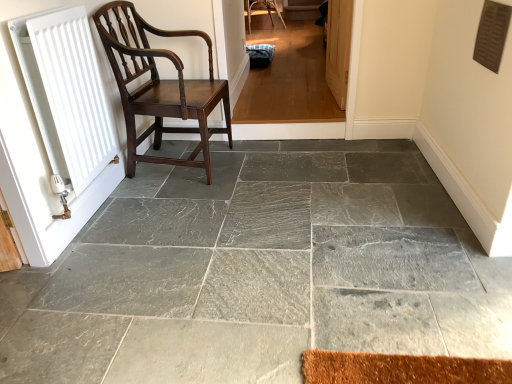
The width and height of the screenshot is (512, 384). What are the coordinates of `wooden screen door at upper right` in the screenshot? It's located at (338, 48).

What do you see at coordinates (159, 86) in the screenshot? I see `dark wood chair at left` at bounding box center [159, 86].

The width and height of the screenshot is (512, 384). Describe the element at coordinates (259, 272) in the screenshot. I see `gray stone floor at center` at that location.

Where is `wooden screen door at upper right`? The width and height of the screenshot is (512, 384). wooden screen door at upper right is located at coordinates (338, 48).

From the image's perspective, would you say white matte radiator at left is positioned over dark wood chair at left?

No, from the image's perspective, white matte radiator at left is not on top of dark wood chair at left.

What's the angular difference between white matte radiator at left and dark wood chair at left's facing directions?

1.58 degrees separate the facing orientations of white matte radiator at left and dark wood chair at left.

From the picture: Can you confirm if white matte radiator at left is positioned to the right of dark wood chair at left?

No, white matte radiator at left is not to the right of dark wood chair at left.

Where is `radiator above the dark wood chair at left (from a real-world perspective)`? Image resolution: width=512 pixels, height=384 pixels. radiator above the dark wood chair at left (from a real-world perspective) is located at coordinates (67, 94).

Considering the relative sizes of wooden screen door at upper right and white matte radiator at left in the image provided, is wooden screen door at upper right taller than white matte radiator at left?

No, wooden screen door at upper right is not taller than white matte radiator at left.

Is white matte radiator at left completely or partially inside wooden screen door at upper right?

No, white matte radiator at left is not inside wooden screen door at upper right.

Which object is thinner, wooden screen door at upper right or white matte radiator at left?

With smaller width is wooden screen door at upper right.

Can you confirm if wooden screen door at upper right is positioned to the left of white matte radiator at left?

No, wooden screen door at upper right is not to the left of white matte radiator at left.

Where is `chair that is on the left side of gray stone floor at center`? Image resolution: width=512 pixels, height=384 pixels. chair that is on the left side of gray stone floor at center is located at coordinates (159, 86).

How many degrees apart are the facing directions of dark wood chair at left and gray stone floor at center?

The facing directions of dark wood chair at left and gray stone floor at center are 86.8 degrees apart.

Does dark wood chair at left lie behind gray stone floor at center?

Yes.

Is point (136, 161) farther from camera compared to point (388, 349)?

Yes.

Considering the positions of objects dark wood chair at left and wooden screen door at upper right in the image provided, who is more to the left, dark wood chair at left or wooden screen door at upper right?

dark wood chair at left.

Between dark wood chair at left and wooden screen door at upper right, which one has smaller width?

wooden screen door at upper right.

Is point (230, 118) closer or farther from the camera than point (348, 15)?

Point (230, 118).

Find the location of a particular element. This screenshot has width=512, height=384. chair that appears below the wooden screen door at upper right (from the image's perspective) is located at coordinates (159, 86).

From the picture: Which object is positioned more to the left, wooden screen door at upper right or dark wood chair at left?

Positioned to the left is dark wood chair at left.

Considering the sizes of objects wooden screen door at upper right and dark wood chair at left in the image provided, who is wider, wooden screen door at upper right or dark wood chair at left?

Wider between the two is dark wood chair at left.

How many degrees apart are the facing directions of wooden screen door at upper right and dark wood chair at left?

wooden screen door at upper right and dark wood chair at left are facing 178 degrees away from each other.

Is gray stone floor at center not inside white matte radiator at left?

That's correct, gray stone floor at center is outside of white matte radiator at left.

From a real-world perspective, does gray stone floor at center stand above white matte radiator at left?

Incorrect, from a real-world perspective, gray stone floor at center is lower than white matte radiator at left.

Looking at this image, considering their positions, is gray stone floor at center located in front of or behind white matte radiator at left?

gray stone floor at center is in front of white matte radiator at left.

Which object is further away from the camera, dark wood chair at left or white matte radiator at left?

dark wood chair at left is more distant.

Does dark wood chair at left turn towards white matte radiator at left?

No, dark wood chair at left is not facing towards white matte radiator at left.

From a real-world perspective, between dark wood chair at left and white matte radiator at left, who is vertically lower?

dark wood chair at left, from a real-world perspective.

Identify the location of radiator on the left of dark wood chair at left. The image size is (512, 384). (67, 94).

Locate an element on the screen. The width and height of the screenshot is (512, 384). radiator that is above the wooden screen door at upper right (from a real-world perspective) is located at coordinates (67, 94).

Estimate the real-world distances between objects in this image. Which object is closer to gray stone floor at center, dark wood chair at left or white matte radiator at left?

dark wood chair at left lies closer to gray stone floor at center than the other object.

Estimate the real-world distances between objects in this image. Which object is further from white matte radiator at left, dark wood chair at left or gray stone floor at center?

gray stone floor at center.

Estimate the real-world distances between objects in this image. Which object is further from gray stone floor at center, white matte radiator at left or dark wood chair at left?

Based on the image, white matte radiator at left appears to be further to gray stone floor at center.

Estimate the real-world distances between objects in this image. Which object is closer to white matte radiator at left, wooden screen door at upper right or gray stone floor at center?

gray stone floor at center is closer to white matte radiator at left.

Estimate the real-world distances between objects in this image. Which object is further from wooden screen door at upper right, white matte radiator at left or gray stone floor at center?

Based on the image, white matte radiator at left appears to be further to wooden screen door at upper right.

From the image, which object appears to be nearer to gray stone floor at center, wooden screen door at upper right or white matte radiator at left?

Among the two, white matte radiator at left is located nearer to gray stone floor at center.

Which object lies nearer to the anchor point white matte radiator at left, gray stone floor at center or wooden screen door at upper right?

gray stone floor at center.

Based on their spatial positions, is dark wood chair at left or white matte radiator at left closer to wooden screen door at upper right?

Based on the image, dark wood chair at left appears to be nearer to wooden screen door at upper right.

Find the location of `radiator between gray stone floor at center and wooden screen door at upper right along the z-axis`. radiator between gray stone floor at center and wooden screen door at upper right along the z-axis is located at coordinates (67, 94).

This screenshot has height=384, width=512. Identify the location of chair between gray stone floor at center and wooden screen door at upper right from front to back. (159, 86).

Where is `chair between white matte radiator at left and wooden screen door at upper right in the horizontal direction`? This screenshot has height=384, width=512. chair between white matte radiator at left and wooden screen door at upper right in the horizontal direction is located at coordinates (159, 86).

The height and width of the screenshot is (384, 512). I want to click on chair between white matte radiator at left and gray stone floor at center in the horizontal direction, so click(159, 86).